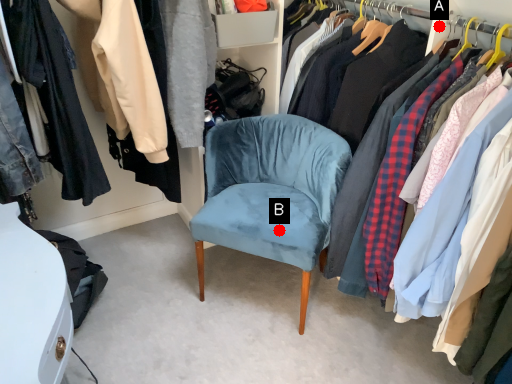
Question: Two points are circled on the image, labeled by A and B beside each circle. Which point appears closest to the camera in this image?

Choices:
 (A) A is closer
 (B) B is closer

Answer: (A)